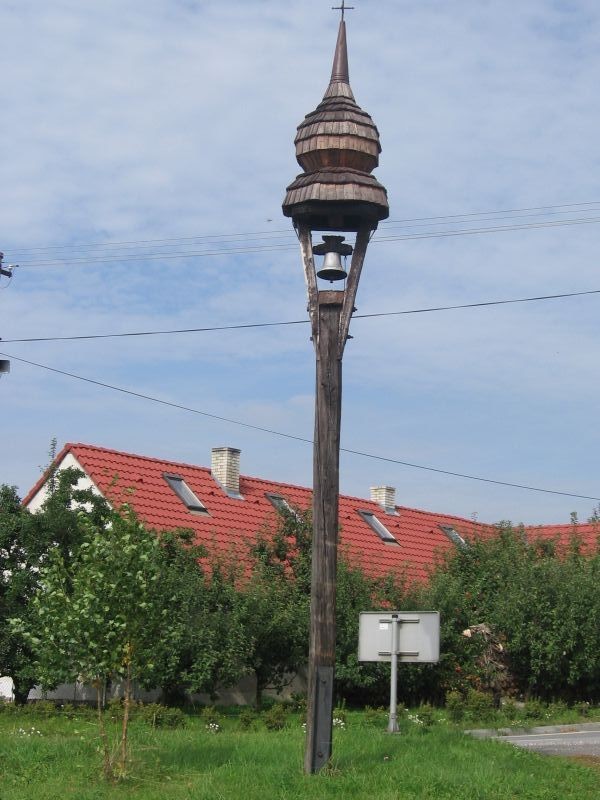
Identify the location of wood post. (327, 494).